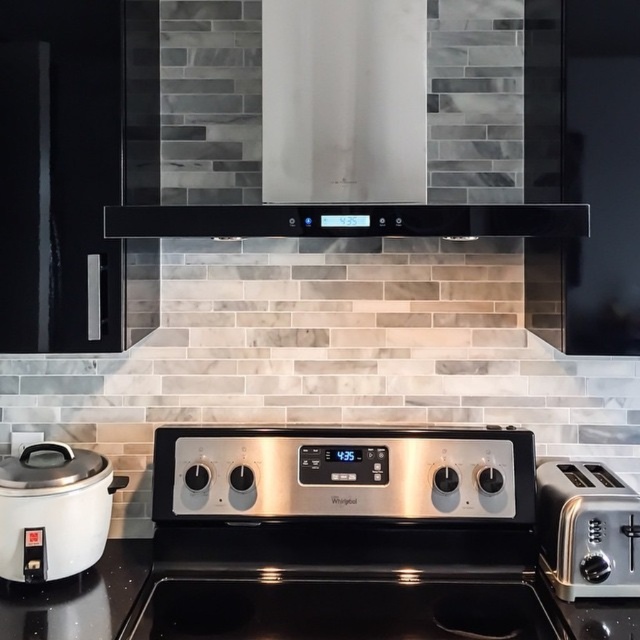
Is black glass exhaust hood at upper center thinner than satin silver toaster at right?

No, black glass exhaust hood at upper center is not thinner than satin silver toaster at right.

Is black glass exhaust hood at upper center wider than satin silver toaster at right?

Correct, the width of black glass exhaust hood at upper center exceeds that of satin silver toaster at right.

Find the location of a particular element. black glass exhaust hood at upper center is located at coordinates (346, 220).

Does point (90, 500) come in front of point (612, 556)?

That is False.

Who is higher up, white glossy rice cooker at lower left or satin silver toaster at right?

white glossy rice cooker at lower left is above.

This screenshot has height=640, width=640. Describe the element at coordinates (52, 509) in the screenshot. I see `white glossy rice cooker at lower left` at that location.

The width and height of the screenshot is (640, 640). I want to click on white glossy rice cooker at lower left, so click(x=52, y=509).

Between black glossy countertop at lower center and white glossy rice cooker at lower left, which one is positioned higher?

Positioned higher is white glossy rice cooker at lower left.

Is point (381, 628) closer to viewer compared to point (56, 548)?

Yes.

Looking at this image, who is more forward, (298, 609) or (12, 548)?

Point (12, 548) is in front.

Locate an element on the screen. This screenshot has width=640, height=640. black glossy countertop at lower center is located at coordinates (312, 586).